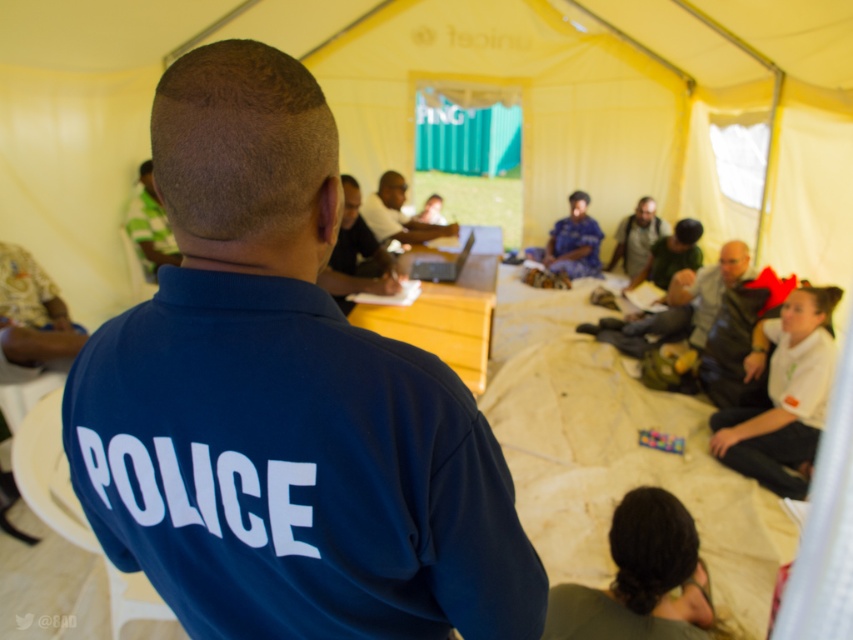
Question: Among these points, which one is farthest from the camera?

Choices:
 (A) (659, 228)
 (B) (454, 269)
 (C) (367, 241)

Answer: (A)

Question: Does green fabric shirt at upper left appear under matte black laptop at center?

Choices:
 (A) no
 (B) yes

Answer: (B)

Question: Can you confirm if matte black shirt at center is wider than blue uniform at center?

Choices:
 (A) no
 (B) yes

Answer: (A)

Question: Estimate the real-world distances between objects in this image. Which object is closer to the white fabric shirt at lower right?

Choices:
 (A) gray fabric shirt at center
 (B) matte black shirt at center
 (C) silver metallic laptop at center
 (D) matte black laptop at center

Answer: (C)

Question: Based on their relative distances, which object is farther from the matte black shirt at center?

Choices:
 (A) green fabric shirt at upper left
 (B) matte black laptop at center
 (C) blue uniform at center
 (D) silver metallic laptop at center

Answer: (C)

Question: Is gray fabric shirt at center positioned in front of silver metallic laptop at center?

Choices:
 (A) yes
 (B) no

Answer: (B)